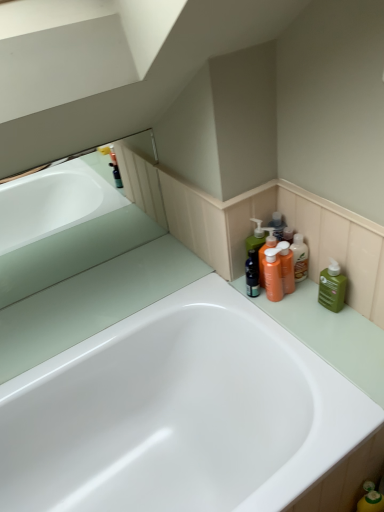
You are a GUI agent. You are given a task and a screenshot of the screen. Output one action in this format:
    pyautogui.click(x=<x>, y=<y>)
    Task: Click on the vacant space in front of green matte bottle at right, marked as the second cleaning product in a left-to-right arrangement
    The height and width of the screenshot is (512, 384).
    Given the screenshot: What is the action you would take?
    pyautogui.click(x=344, y=342)